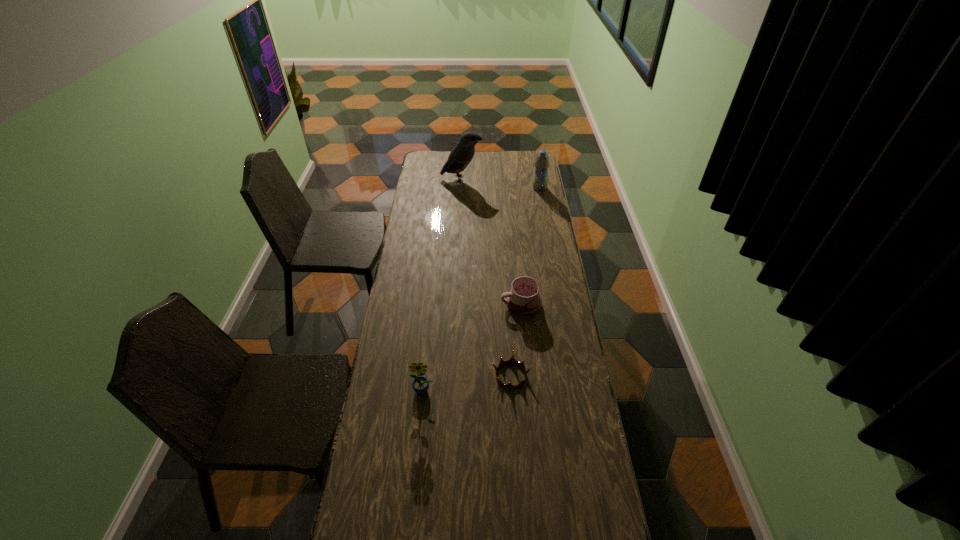
The image size is (960, 540). Find the location of `vacant space located on the front-facing side of the third shortest object`. vacant space located on the front-facing side of the third shortest object is located at coordinates (420, 418).

Locate an element on the screen. This screenshot has width=960, height=540. free space located on the side with the handle of the mug is located at coordinates (426, 304).

Where is `vacant space situated 0.390m on the side with the handle of the mug`? Image resolution: width=960 pixels, height=540 pixels. vacant space situated 0.390m on the side with the handle of the mug is located at coordinates (407, 304).

Image resolution: width=960 pixels, height=540 pixels. I want to click on vacant space located 0.100m on the side with the handle of the mug, so click(477, 304).

Image resolution: width=960 pixels, height=540 pixels. Find the location of `vacant space located 0.170m on the front of the crown`. vacant space located 0.170m on the front of the crown is located at coordinates (515, 438).

The width and height of the screenshot is (960, 540). I want to click on parrot positioned at the left edge, so click(x=461, y=155).

At what (x,y) coordinates should I click in order to perform the action: click on sunflower that is at the left edge. Please return your answer as a coordinate pair (x, y). Image resolution: width=960 pixels, height=540 pixels. Looking at the image, I should click on (420, 385).

In order to click on water bottle that is positioned at the right edge in this screenshot , I will do click(542, 161).

Locate an element on the screen. The image size is (960, 540). mug that is at the right edge is located at coordinates (523, 299).

This screenshot has height=540, width=960. Find the location of `free space at the left edge`. free space at the left edge is located at coordinates (437, 190).